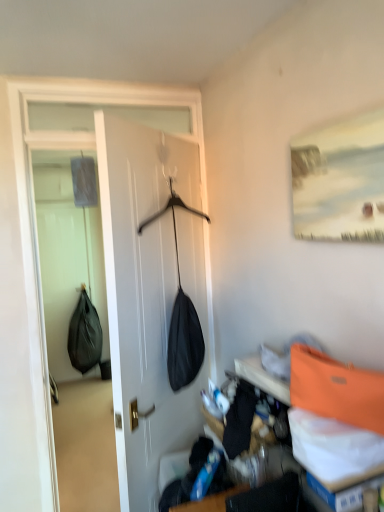
Question: Is orange fabric shoulder bag at upper right, the 2th shoulder bag from the back, outside black matte shoulder bag at left, acting as the 1th shoulder bag starting from the bottom?

Choices:
 (A) no
 (B) yes

Answer: (B)

Question: From a real-world perspective, is orange fabric shoulder bag at upper right, the 2th shoulder bag from the back, located higher than black matte shoulder bag at left, the second shoulder bag when ordered from front to back?

Choices:
 (A) yes
 (B) no

Answer: (A)

Question: Is orange fabric shoulder bag at upper right, placed as the first shoulder bag when sorted from front to back, surrounding black matte shoulder bag at left, the 1th shoulder bag positioned from the back?

Choices:
 (A) no
 (B) yes

Answer: (A)

Question: From the image's perspective, is orange fabric shoulder bag at upper right, marked as the first shoulder bag in a right-to-left arrangement, beneath black matte shoulder bag at left, which ranks as the 1th shoulder bag in left-to-right order?

Choices:
 (A) yes
 (B) no

Answer: (B)

Question: Is orange fabric shoulder bag at upper right, the 2th shoulder bag from the back, taller than black matte shoulder bag at left, which ranks as the 1th shoulder bag in left-to-right order?

Choices:
 (A) no
 (B) yes

Answer: (A)

Question: From the image's perspective, is black matte shoulder bag at left, arranged as the second shoulder bag when viewed from the right, positioned above or below orange fabric shoulder bag at upper right, placed as the first shoulder bag when sorted from front to back?

Choices:
 (A) above
 (B) below

Answer: (B)

Question: Based on their positions, is black matte shoulder bag at left, which ranks as the 1th shoulder bag in left-to-right order, located to the left or right of orange fabric shoulder bag at upper right, the 1th shoulder bag from the top?

Choices:
 (A) left
 (B) right

Answer: (A)

Question: From their relative heights in the image, would you say black matte shoulder bag at left, the 1th shoulder bag positioned from the back, is taller or shorter than orange fabric shoulder bag at upper right, the 2th shoulder bag from the back?

Choices:
 (A) short
 (B) tall

Answer: (B)

Question: Relative to orange fabric shoulder bag at upper right, marked as the first shoulder bag in a right-to-left arrangement, is black matte shoulder bag at left, arranged as the second shoulder bag when viewed from the right, in front or behind?

Choices:
 (A) behind
 (B) front

Answer: (A)

Question: From the image's perspective, is black matte shoulder bag at left, which is the second shoulder bag from top to bottom, located above or below matte white painting at upper right?

Choices:
 (A) below
 (B) above

Answer: (A)

Question: Is black matte shoulder bag at left, acting as the 1th shoulder bag starting from the bottom, inside the boundaries of matte white painting at upper right, or outside?

Choices:
 (A) outside
 (B) inside

Answer: (A)

Question: Considering the positions of point (69, 356) and point (317, 178), is point (69, 356) closer or farther from the camera than point (317, 178)?

Choices:
 (A) closer
 (B) farther

Answer: (B)

Question: Considering their positions, is black matte shoulder bag at left, arranged as the second shoulder bag when viewed from the right, located in front of or behind matte white painting at upper right?

Choices:
 (A) front
 (B) behind

Answer: (B)

Question: From the image's perspective, relative to black matte shoulder bag at left, which ranks as the 1th shoulder bag in left-to-right order, is orange fabric shoulder bag at upper right, placed as the first shoulder bag when sorted from front to back, above or below?

Choices:
 (A) above
 (B) below

Answer: (A)

Question: Is orange fabric shoulder bag at upper right, marked as the first shoulder bag in a right-to-left arrangement, situated inside black matte shoulder bag at left, the 1th shoulder bag positioned from the back, or outside?

Choices:
 (A) outside
 (B) inside

Answer: (A)